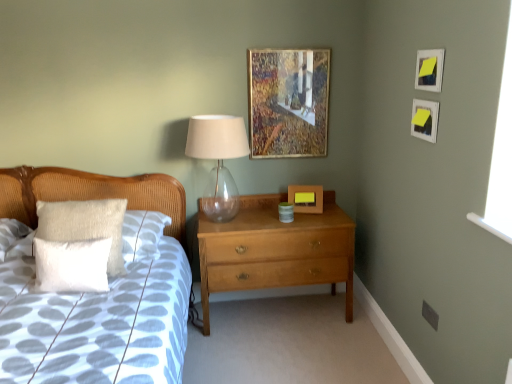
Describe the element at coordinates (429, 69) in the screenshot. This screenshot has width=512, height=384. I see `yellow paper at upper right, which ranks as the fourth picture frame in back-to-front order` at that location.

The width and height of the screenshot is (512, 384). Describe the element at coordinates (275, 250) in the screenshot. I see `light brown wood chest of drawers at center` at that location.

How much space does white fluffy pillow at left, marked as the 1th pillow in a back-to-front arrangement, occupy vertically?

47.78 centimeters.

The width and height of the screenshot is (512, 384). Find the location of `white soft pillow at left`. white soft pillow at left is located at coordinates (96, 293).

This screenshot has height=384, width=512. What are the coordinates of `wooden picture frame at center, which is the first picture frame in back-to-front order` in the screenshot? It's located at (306, 198).

Image resolution: width=512 pixels, height=384 pixels. What do you see at coordinates (71, 265) in the screenshot?
I see `white textured pillow at left, placed as the second pillow when sorted from back to front` at bounding box center [71, 265].

Find the location of a particular element. wooden picture frame at upper center, positioned as the second picture frame in back-to-front order is located at coordinates (288, 102).

Identify the location of yellow paper at upper right, which ranks as the fourth picture frame in back-to-front order. (429, 69).

Considering the positions of points (125, 345) and (110, 209), is point (125, 345) farther from camera compared to point (110, 209)?

No.

Which is behind, white soft pillow at left or white fluffy pillow at left, marked as the second pillow in a front-to-back arrangement?

white fluffy pillow at left, marked as the second pillow in a front-to-back arrangement, is behind.

Considering the relative positions of white soft pillow at left and white fluffy pillow at left, marked as the second pillow in a front-to-back arrangement, in the image provided, is white soft pillow at left to the left of white fluffy pillow at left, marked as the second pillow in a front-to-back arrangement, from the viewer's perspective?

Correct, you'll find white soft pillow at left to the left of white fluffy pillow at left, marked as the second pillow in a front-to-back arrangement.

From a real-world perspective, does white soft pillow at left sit lower than white fluffy pillow at left, marked as the second pillow in a front-to-back arrangement?

Yes.

From the image's perspective, is wooden picture frame at upper center, the 4th picture frame when ordered from right to left, below white soft pillow at left?

Incorrect, from the image's perspective, wooden picture frame at upper center, the 4th picture frame when ordered from right to left, is higher than white soft pillow at left.

Is wooden picture frame at upper center, positioned as the 3th picture frame in front-to-back order, facing towards white soft pillow at left?

No, wooden picture frame at upper center, positioned as the 3th picture frame in front-to-back order, is not oriented towards white soft pillow at left.

Is wooden picture frame at upper center, the 4th picture frame when ordered from right to left, inside or outside of white soft pillow at left?

wooden picture frame at upper center, the 4th picture frame when ordered from right to left, exists outside the volume of white soft pillow at left.

Based on the photo, how different are the orientations of wooden picture frame at upper center, positioned as the second picture frame in back-to-front order, and white soft pillow at left in degrees?

The facing directions of wooden picture frame at upper center, positioned as the second picture frame in back-to-front order, and white soft pillow at left are 0.367 degrees apart.

This screenshot has width=512, height=384. I want to click on the 2nd pillow below the wooden picture frame at upper center, which appears as the 1th picture frame when viewed from the left (from the image's perspective), so click(x=71, y=265).

Based on the photo, considering the positions of objects white textured pillow at left, placed as the second pillow when sorted from back to front, and wooden picture frame at upper center, positioned as the second picture frame in back-to-front order, in the image provided, who is more to the left, white textured pillow at left, placed as the second pillow when sorted from back to front, or wooden picture frame at upper center, positioned as the second picture frame in back-to-front order,?

white textured pillow at left, placed as the second pillow when sorted from back to front, is more to the left.

Is wooden picture frame at upper center, which appears as the 1th picture frame when viewed from the left, a part of white textured pillow at left, placed as the second pillow when sorted from back to front?

No.

From the picture: Could you tell me if white textured pillow at left, placed as the second pillow when sorted from back to front, is facing wooden picture frame at upper center, positioned as the 3th picture frame in front-to-back order?

No, white textured pillow at left, placed as the second pillow when sorted from back to front, is not turned towards wooden picture frame at upper center, positioned as the 3th picture frame in front-to-back order.

Is transparent glass table lamp at center surrounding white textured pillow at left, which ranks as the first pillow in front-to-back order?

Definitely not — white textured pillow at left, which ranks as the first pillow in front-to-back order, is not inside transparent glass table lamp at center.

From the picture: From the image's perspective, relative to white textured pillow at left, which ranks as the first pillow in front-to-back order, is transparent glass table lamp at center above or below?

transparent glass table lamp at center is above white textured pillow at left, which ranks as the first pillow in front-to-back order.

Which object is wider, transparent glass table lamp at center or white textured pillow at left, placed as the second pillow when sorted from back to front?

transparent glass table lamp at center is wider.

Based on the photo, is the position of transparent glass table lamp at center less distant than that of white textured pillow at left, placed as the second pillow when sorted from back to front?

No, it is not.

This screenshot has height=384, width=512. In order to click on chest of drawers on the right of the transparent glass table lamp at center in this screenshot , I will do `click(275, 250)`.

Can you confirm if transparent glass table lamp at center is shorter than light brown wood chest of drawers at center?

Yes, transparent glass table lamp at center is shorter than light brown wood chest of drawers at center.

Is light brown wood chest of drawers at center at the back of transparent glass table lamp at center?

No, transparent glass table lamp at center is not facing away from light brown wood chest of drawers at center.

From a real-world perspective, is transparent glass table lamp at center positioned over light brown wood chest of drawers at center based on gravity?

Indeed, from a real-world perspective, transparent glass table lamp at center stands above light brown wood chest of drawers at center.

From the image's perspective, relative to light brown wood chest of drawers at center, is white soft pillow at left above or below?

white soft pillow at left is below light brown wood chest of drawers at center.

In the image, is white soft pillow at left on the left side or the right side of light brown wood chest of drawers at center?

white soft pillow at left is positioned on light brown wood chest of drawers at center's left side.

From a real-world perspective, which is physically below, white soft pillow at left or light brown wood chest of drawers at center?

From a 3D spatial view, light brown wood chest of drawers at center is below.

Between white soft pillow at left and light brown wood chest of drawers at center, which one has larger width?

Wider between the two is white soft pillow at left.

Between wooden picture frame at upper center, positioned as the 3th picture frame in front-to-back order, and white textured pillow at left, which ranks as the first pillow in front-to-back order, which one has more height?

wooden picture frame at upper center, positioned as the 3th picture frame in front-to-back order, is taller.

From a real-world perspective, which pillow is the 2nd one underneath the wooden picture frame at upper center, which appears as the 1th picture frame when viewed from the left? Please provide its 2D coordinates.

[(71, 265)]

Consider the image. Is wooden picture frame at upper center, positioned as the second picture frame in back-to-front order, beside white textured pillow at left, placed as the second pillow when sorted from back to front?

No, wooden picture frame at upper center, positioned as the second picture frame in back-to-front order, is not with white textured pillow at left, placed as the second pillow when sorted from back to front.

Is wooden picture frame at upper center, positioned as the 3th picture frame in front-to-back order, bigger or smaller than white textured pillow at left, placed as the second pillow when sorted from back to front?

Clearly, wooden picture frame at upper center, positioned as the 3th picture frame in front-to-back order, is smaller in size than white textured pillow at left, placed as the second pillow when sorted from back to front.

Where is `bed below the white fluffy pillow at left, marked as the second pillow in a front-to-back arrangement (from the image's perspective)`? bed below the white fluffy pillow at left, marked as the second pillow in a front-to-back arrangement (from the image's perspective) is located at coordinates point(96,293).

Where is `the 3rd picture frame behind the white soft pillow at left, starting your count from the anchor`? This screenshot has height=384, width=512. the 3rd picture frame behind the white soft pillow at left, starting your count from the anchor is located at coordinates (288, 102).

Based on their spatial positions, is matte white picture frame at upper right, acting as the first picture frame starting from the right, or yellow paper at upper right, the second picture frame positioned from the right, closer to wooden picture frame at center, positioned as the 2th picture frame in left-to-right order?

Among the two, matte white picture frame at upper right, acting as the first picture frame starting from the right, is located nearer to wooden picture frame at center, positioned as the 2th picture frame in left-to-right order.

Which object lies nearer to the anchor point white textured pillow at left, which ranks as the first pillow in front-to-back order, yellow paper at upper right, which ranks as the fourth picture frame in back-to-front order, or matte white picture frame at upper right, acting as the first picture frame starting from the right?

Among the two, matte white picture frame at upper right, acting as the first picture frame starting from the right, is located nearer to white textured pillow at left, which ranks as the first pillow in front-to-back order.

Considering their positions, is white textured pillow at left, which ranks as the first pillow in front-to-back order, positioned further to wooden picture frame at upper center, positioned as the second picture frame in back-to-front order, than matte white picture frame at upper right, acting as the 3th picture frame starting from the back?

Based on the image, white textured pillow at left, which ranks as the first pillow in front-to-back order, appears to be further to wooden picture frame at upper center, positioned as the second picture frame in back-to-front order.

Which object lies further to the anchor point wooden picture frame at upper center, the 4th picture frame when ordered from right to left, wooden picture frame at center, the 4th picture frame when ordered from front to back, or transparent glass table lamp at center?

The object further to wooden picture frame at upper center, the 4th picture frame when ordered from right to left, is wooden picture frame at center, the 4th picture frame when ordered from front to back.

Which object lies nearer to the anchor point light brown wood chest of drawers at center, wooden picture frame at center, the 4th picture frame when ordered from front to back, or wooden picture frame at upper center, which appears as the 1th picture frame when viewed from the left?

Among the two, wooden picture frame at center, the 4th picture frame when ordered from front to back, is located nearer to light brown wood chest of drawers at center.

From the image, which object appears to be farther from white textured pillow at left, which ranks as the first pillow in front-to-back order, wooden picture frame at upper center, the 4th picture frame when ordered from right to left, or white fluffy pillow at left, marked as the second pillow in a front-to-back arrangement?

Based on the image, wooden picture frame at upper center, the 4th picture frame when ordered from right to left, appears to be further to white textured pillow at left, which ranks as the first pillow in front-to-back order.

From the image, which object appears to be farther from white fluffy pillow at left, marked as the 1th pillow in a back-to-front arrangement, wooden picture frame at upper center, which appears as the 1th picture frame when viewed from the left, or matte white picture frame at upper right, acting as the 3th picture frame starting from the back?

matte white picture frame at upper right, acting as the 3th picture frame starting from the back, is positioned further to the anchor white fluffy pillow at left, marked as the 1th pillow in a back-to-front arrangement.

Which object lies further to the anchor point wooden picture frame at upper center, the 4th picture frame when ordered from right to left, matte white picture frame at upper right, which is the 2th picture frame from front to back, or white soft pillow at left?

white soft pillow at left lies further to wooden picture frame at upper center, the 4th picture frame when ordered from right to left, than the other object.

At what (x,y) coordinates should I click in order to perform the action: click on the chest of drawers located between white fluffy pillow at left, marked as the second pillow in a front-to-back arrangement, and wooden picture frame at upper center, positioned as the 3th picture frame in front-to-back order, in the left-right direction. Please return your answer as a coordinate pair (x, y). Looking at the image, I should click on (275, 250).

The image size is (512, 384). I want to click on table lamp between white fluffy pillow at left, marked as the second pillow in a front-to-back arrangement, and wooden picture frame at upper center, positioned as the 3th picture frame in front-to-back order, so click(x=218, y=160).

The width and height of the screenshot is (512, 384). In order to click on pillow between white fluffy pillow at left, marked as the 1th pillow in a back-to-front arrangement, and wooden picture frame at upper center, the 4th picture frame when ordered from right to left, in the horizontal direction in this screenshot , I will do `click(71, 265)`.

Identify the location of picture frame between matte white picture frame at upper right, acting as the 3th picture frame starting from the back, and wooden picture frame at center, the 4th picture frame when ordered from front to back, in the front-back direction. (288, 102).